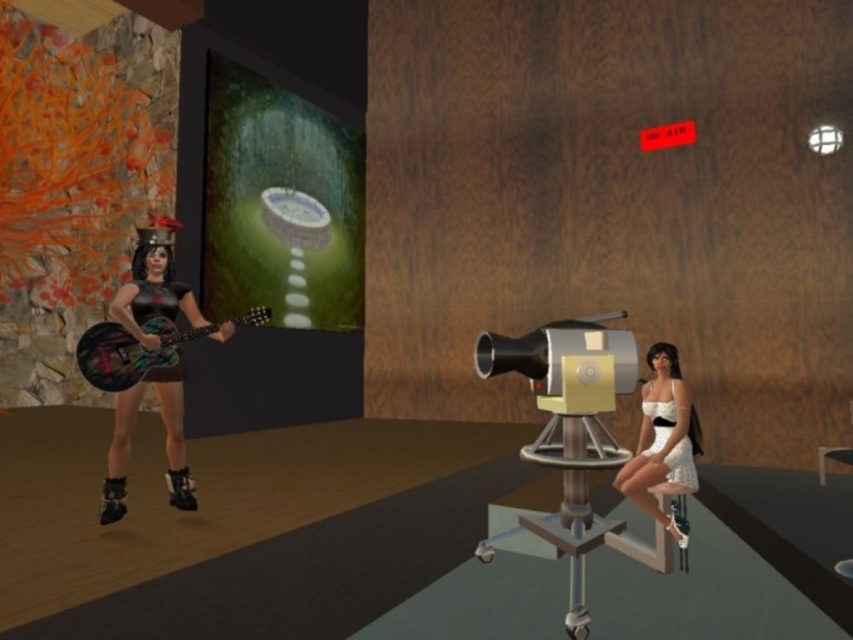
Question: Where is white satin dress at center located in relation to wooden stool at lower right in the image?

Choices:
 (A) left
 (B) right

Answer: (A)

Question: Which point is farther to the camera?

Choices:
 (A) wooden stool at lower right
 (B) shiny black dress at left
 (C) matte black guitar at left
 (D) white satin dress at center

Answer: (B)

Question: Which point is closer to the camera?

Choices:
 (A) wooden stool at lower right
 (B) matte black guitar at left
 (C) white satin dress at center
 (D) shiny black dress at left

Answer: (C)

Question: Can you confirm if white satin dress at center is positioned below wooden stool at lower right?

Choices:
 (A) yes
 (B) no

Answer: (A)

Question: Which object is closer to the camera taking this photo?

Choices:
 (A) white satin dress at center
 (B) shiny black dress at left
 (C) matte black guitar at left
 (D) white satin dress at lower right

Answer: (A)

Question: Is white satin dress at lower right closer to camera compared to wooden stool at lower right?

Choices:
 (A) no
 (B) yes

Answer: (A)